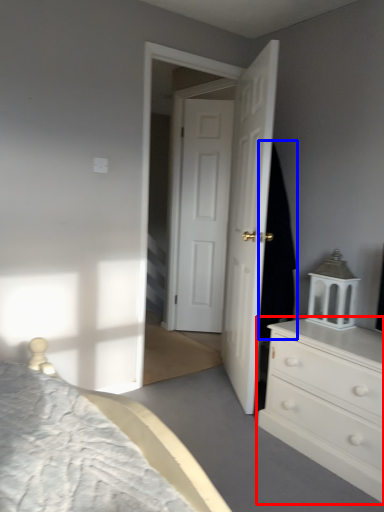
Question: Which of the following is the closest to the observer, chest of drawers (highlighted by a red box) or dark (highlighted by a blue box)?

Choices:
 (A) chest of drawers
 (B) dark

Answer: (A)